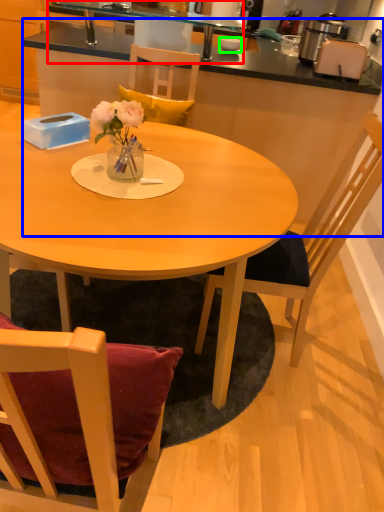
Question: Which object is the closest to the sink (highlighted by a red box)? Choose among these: table (highlighted by a blue box) or coffee cup (highlighted by a green box).

Choices:
 (A) table
 (B) coffee cup

Answer: (B)